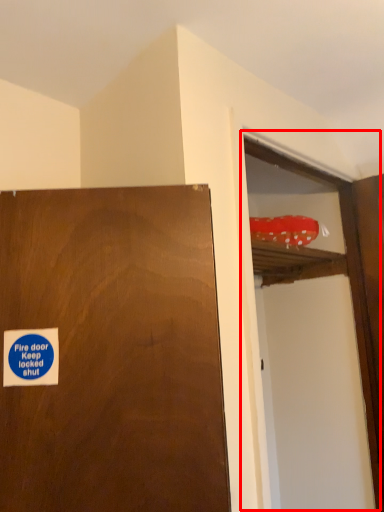
Question: From the image, what is the correct spatial relationship of screen door (annotated by the red box) in relation to sticker?

Choices:
 (A) left
 (B) right

Answer: (B)